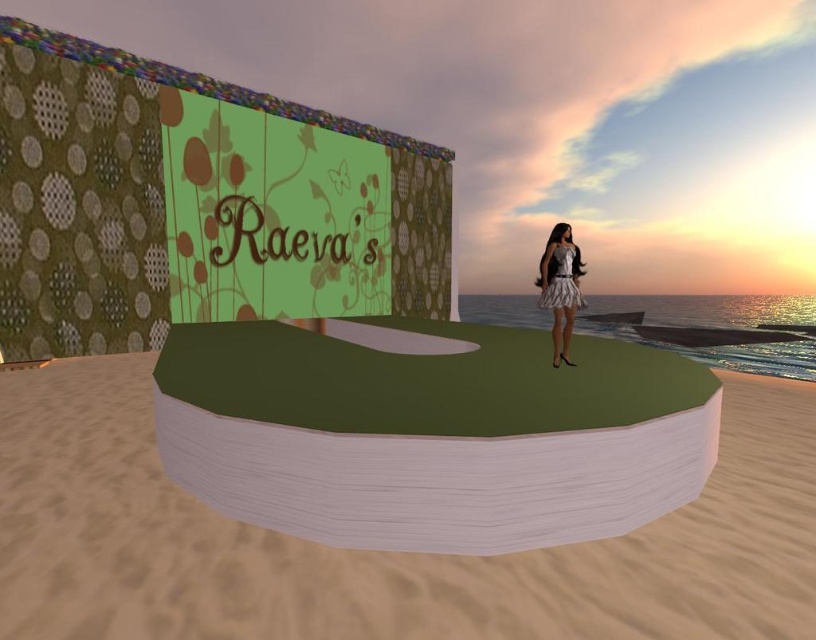
How far apart are green matte sand at center and white satin dress at center?

3.57 meters

Is green matte sand at center thinner than white satin dress at center?

No, green matte sand at center is not thinner than white satin dress at center.

You are a GUI agent. You are given a task and a screenshot of the screen. Output one action in this format:
    pyautogui.click(x=<x>, y=<y>)
    Task: Click on the green matte sand at center
    
    Given the screenshot: What is the action you would take?
    pyautogui.click(x=378, y=552)

Does green matte sand at center have a lesser width compared to green wood golf course at center?

No, green matte sand at center is not thinner than green wood golf course at center.

Measure the distance between point (327, 627) and camera.

Point (327, 627) is 2.28 meters away from camera.

You are a GUI agent. You are given a task and a screenshot of the screen. Output one action in this format:
    pyautogui.click(x=<x>, y=<y>)
    Task: Click on the green matte sand at center
    This screenshot has width=816, height=640.
    Given the screenshot: What is the action you would take?
    pyautogui.click(x=378, y=552)

Is green wood golf course at center to the left of white satin dress at center from the viewer's perspective?

Correct, you'll find green wood golf course at center to the left of white satin dress at center.

Is green wood golf course at center shorter than white satin dress at center?

Yes, green wood golf course at center is shorter than white satin dress at center.

This screenshot has width=816, height=640. Describe the element at coordinates (429, 433) in the screenshot. I see `green wood golf course at center` at that location.

This screenshot has width=816, height=640. Identify the location of green wood golf course at center. (429, 433).